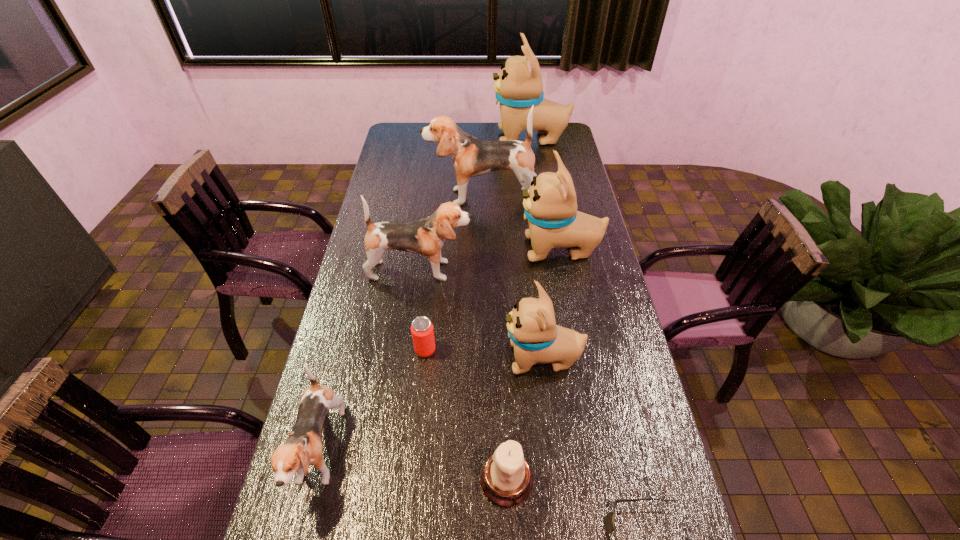
Where is `puppy that is the sixth nearest to the red beer can`? The width and height of the screenshot is (960, 540). puppy that is the sixth nearest to the red beer can is located at coordinates (518, 87).

Identify which puppy is the second nearest to the farthest object. Please provide its 2D coordinates. Your answer should be formatted as a tuple, i.e. [(x, y)], where the tuple contains the x and y coordinates of a point satisfying the conditions above.

[(550, 204)]

The width and height of the screenshot is (960, 540). I want to click on beige puppy object that ranks as the closest to the candle holder, so click(x=536, y=338).

The height and width of the screenshot is (540, 960). Identify the location of beige puppy that is the second closest to the white candle holder. click(550, 204).

Identify which brown puppy is located as the second nearest to the sixth tallest object. Please provide its 2D coordinates. Your answer should be formatted as a tuple, i.e. [(x, y)], where the tuple contains the x and y coordinates of a point satisfying the conditions above.

[(471, 157)]

Identify which brown puppy is located as the second nearest to the second nearest brown puppy. Please provide its 2D coordinates. Your answer should be formatted as a tuple, i.e. [(x, y)], where the tuple contains the x and y coordinates of a point satisfying the conditions above.

[(303, 447)]

The height and width of the screenshot is (540, 960). Identify the location of vacant position in the image that satisfies the following two spatial constraints: 1. at the face of the candle holder; 2. on the right side of the biggest brown puppy. (482, 479).

Where is `free location that satisfies the following two spatial constraints: 1. at the face of the second biggest brown puppy; 2. on the right side of the beer can`? free location that satisfies the following two spatial constraints: 1. at the face of the second biggest brown puppy; 2. on the right side of the beer can is located at coordinates (410, 350).